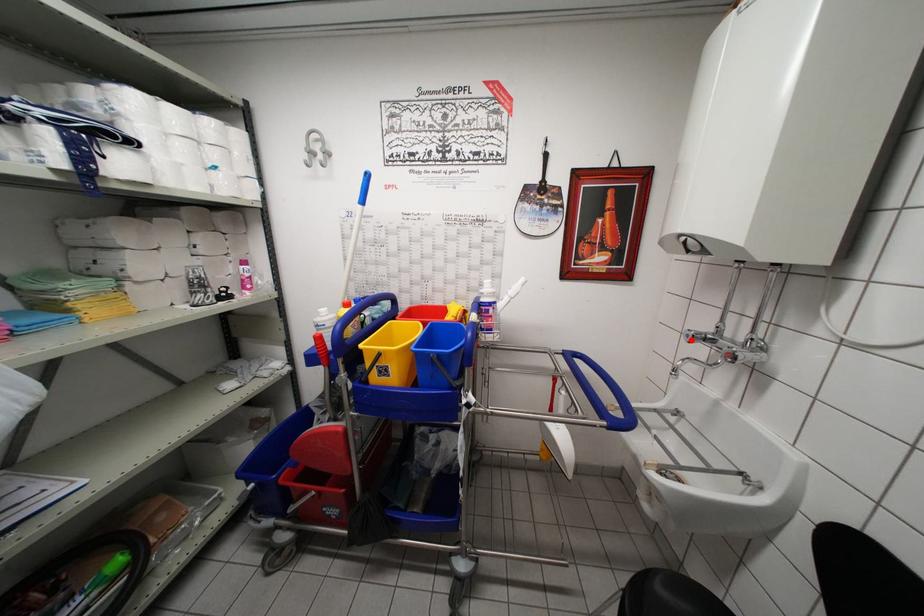
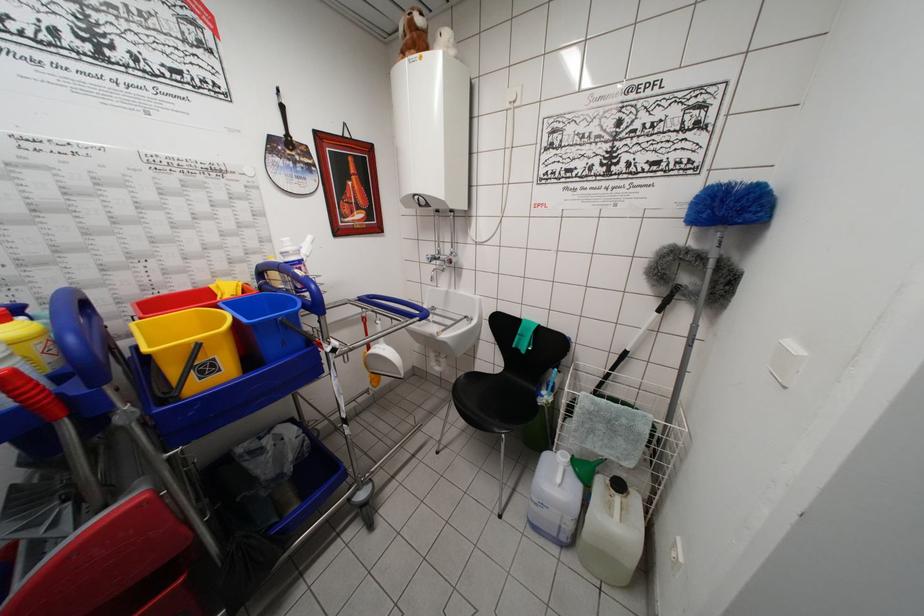
Find the pixel in the second image that matches the highlighted location in the first image.

(432, 262)